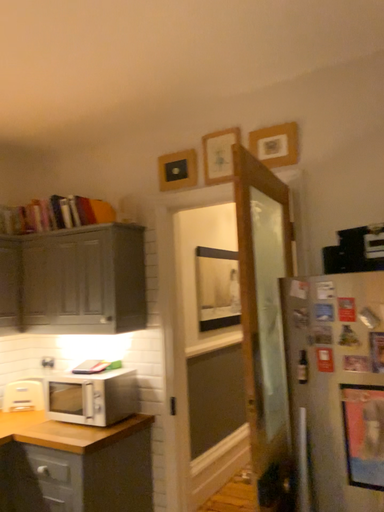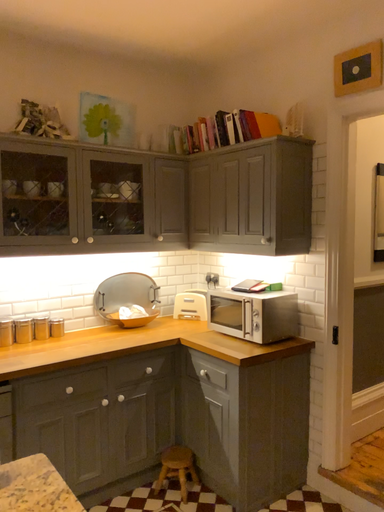
Question: How did the camera likely rotate when shooting the video?

Choices:
 (A) rotated right
 (B) rotated left

Answer: (B)